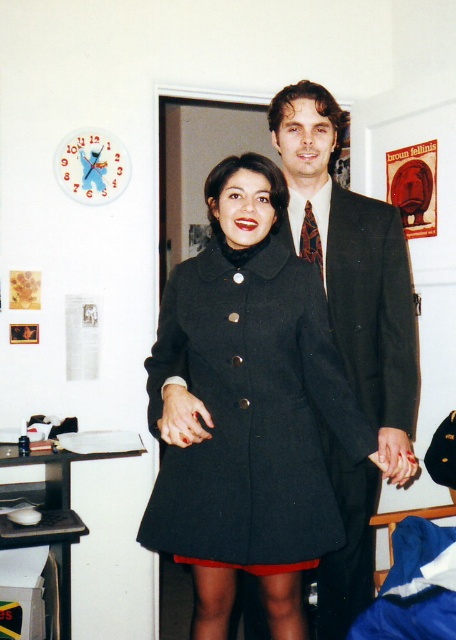
You are organizing a charity event and need to arrange two outfits on a display rack. The display rack has a limited width of 1.2 meters. You have the matte black coat at center and the dark wool suit at center. Based on their sizes, which outfit will require more space on the rack?

The matte black coat at center requires more space on the rack because its width is larger than the dark wool suit at center.

You are an interior designer assessing the placement of furniture in a room. You notice the matte black coat at center. Based on its coordinates at point 0.644, 0.548, can you determine if it is positioned closer to the left or right side of the room?

The matte black coat at center is located at point (249,412), which indicates it is closer to the right side of the room since the x coordinate is above 0.5.